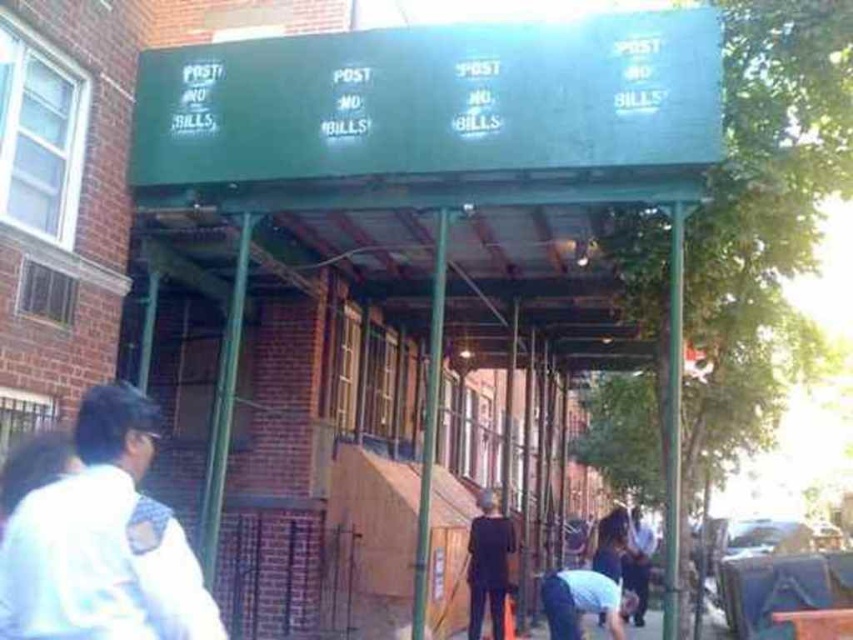
You are standing in front of the building with the green awning labeled POST NO BILLS. There is a point at coordinates (434, 115). What object does this point correspond to?

The point at coordinates (434, 115) corresponds to the green matte awning at upper center.

You are standing in front of the building and want to hang a small sign on the closest object. Which object should you choose between the green matte awning at upper center and the light blue fabric at lower center?

The green matte awning at upper center is closer to the viewer than the light blue fabric at lower center, so you should choose the green matte awning at upper center to hang the small sign.